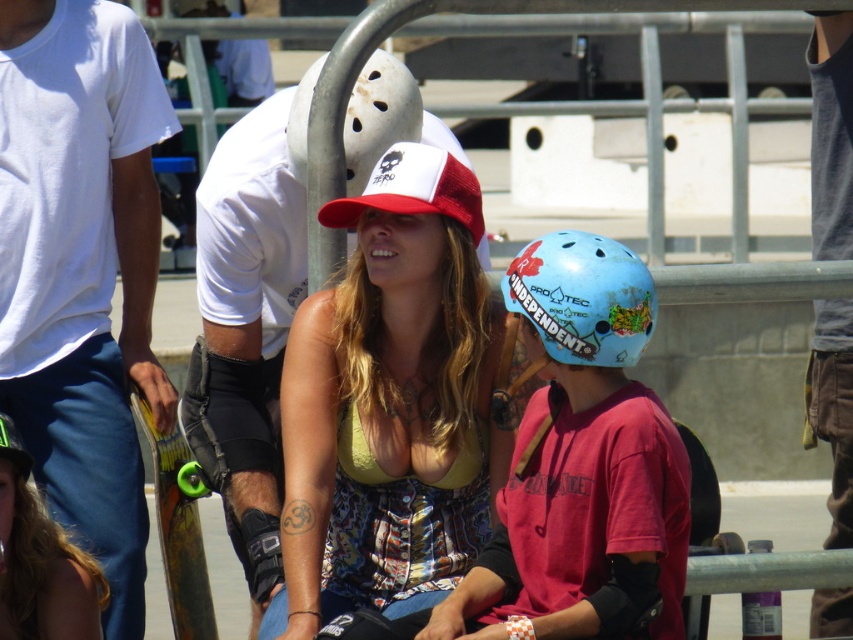
Question: Is blue matte helmet at center-right below multicolored fabric top at center?

Choices:
 (A) yes
 (B) no

Answer: (B)

Question: Which object is positioned closest to the blue matte helmet at center-right?

Choices:
 (A) blue matte helmet at center
 (B) multicolored fabric top at center
 (C) matte yellow tank top at center
 (D) white cotton t-shirt at left

Answer: (A)

Question: Among these objects, which one is nearest to the camera?

Choices:
 (A) blue matte helmet at center-right
 (B) green rubber skateboard at lower left
 (C) white matte helmet at upper center
 (D) blue matte helmet at center

Answer: (D)

Question: Is matte yellow tank top at center further to the viewer compared to green rubber skateboard at lower left?

Choices:
 (A) no
 (B) yes

Answer: (A)

Question: Does blue matte helmet at center appear on the right side of blue matte helmet at center-right?

Choices:
 (A) no
 (B) yes

Answer: (A)

Question: Which point is farther from the camera taking this photo?

Choices:
 (A) (165, 572)
 (B) (666, 561)
 (C) (576, 305)

Answer: (A)